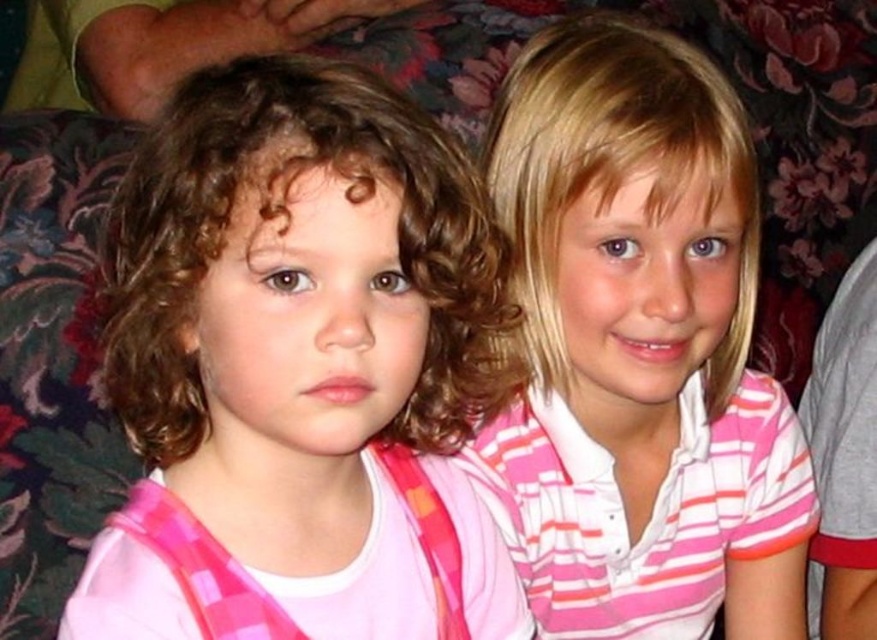
You are a photographer trying to focus on the pink plaid shirt at left. Based on its position coordinates, can you determine if it is located in the upper half or lower half of the image?

The pink plaid shirt at left is located at point coordinates of 0.580 on the x axis and 0.344 on the y axis. Since the y coordinate is below 0.5, it is in the lower half of the image.

In the scene shown: You are a photographer trying to capture a closeup shot of both the pink plaid shirt at left and the pink striped shirt at upper right. Given that your camera can focus on objects within a 6 inch range, will you be able to capture both shirts in focus?

The pink plaid shirt at left is 6.90 inches away from the pink striped shirt at upper right. Since the distance between them exceeds the camera focus range of 6 inches, you won that capture both shirts in focus simultaneously.

You are a photographer trying to capture a closeup shot of the pink plaid shirt at left. Based on the scene description, is the shirt within the optimal focus range of your camera lens, which has a minimum focusing distance of 18 inches?

The pink plaid shirt at left is 18.57 inches away from the camera, which is just beyond the lens minimum focusing distance of 18 inches. Therefore, the shirt is slightly out of the optimal focus range and may appear blurry unless adjusted.